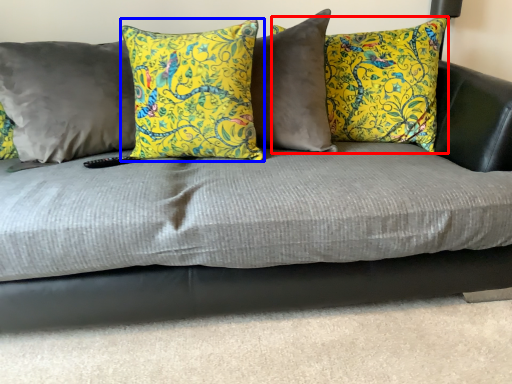
Question: Which point is closer to the camera, pillow (highlighted by a red box) or pillow (highlighted by a blue box)?

Choices:
 (A) pillow
 (B) pillow

Answer: (B)